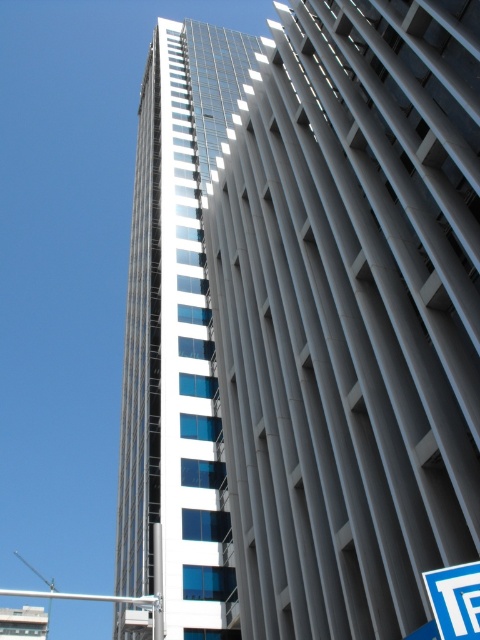
Can you confirm if glassy reflective building at center is taller than silver metallic pole at center?

In fact, glassy reflective building at center may be shorter than silver metallic pole at center.

How distant is glassy reflective building at center from silver metallic pole at center?

glassy reflective building at center and silver metallic pole at center are 64.70 meters apart.

Does point (153, 312) come behind point (47, 593)?

No, (153, 312) is in front of (47, 593).

At what (x,y) coordinates should I click in order to perform the action: click on glassy reflective building at center. Please return your answer as a coordinate pair (x, y). Looking at the image, I should click on (177, 339).

Does blue plastic street sign at lower right come behind silver metallic pole at center?

That is False.

This screenshot has width=480, height=640. What do you see at coordinates (455, 600) in the screenshot?
I see `blue plastic street sign at lower right` at bounding box center [455, 600].

Locate an element on the screen. blue plastic street sign at lower right is located at coordinates (455, 600).

Is point (295, 170) closer to camera compared to point (183, 232)?

That is True.

Between point (374, 372) and point (225, 637), which one is positioned in front?

Point (374, 372) is more forward.

I want to click on smooth glass building at center, so click(350, 316).